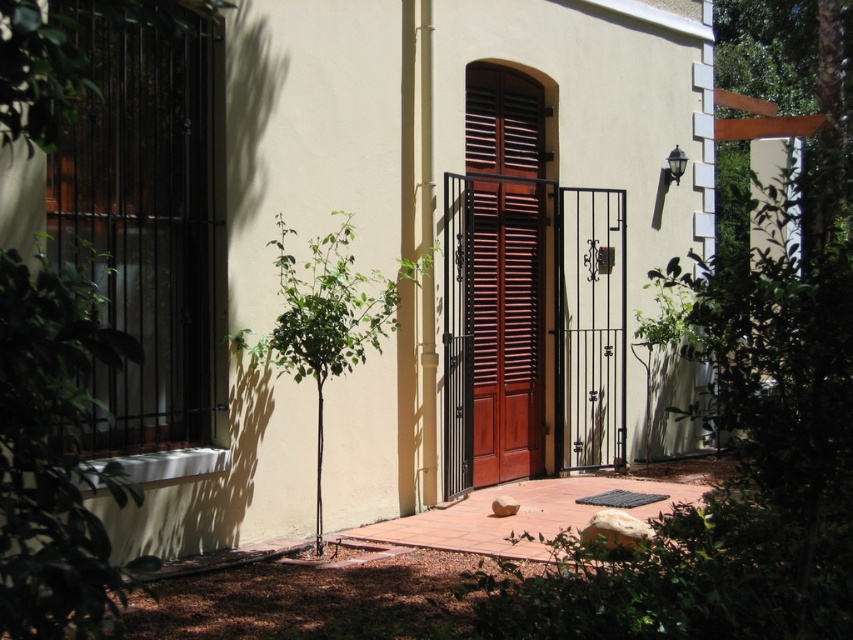
Question: Which of the following is the farthest from the observer?

Choices:
 (A) brown wooden shutters at center
 (B) black matte shutter at left

Answer: (A)

Question: Can you confirm if black matte shutter at left is positioned to the left of brown wooden shutters at center?

Choices:
 (A) no
 (B) yes

Answer: (B)

Question: Is black matte shutter at left smaller than brown wooden shutters at center?

Choices:
 (A) yes
 (B) no

Answer: (A)

Question: Does black matte shutter at left have a greater width compared to brown wooden shutters at center?

Choices:
 (A) no
 (B) yes

Answer: (A)

Question: Among these points, which one is nearest to the camera?

Choices:
 (A) (473, 481)
 (B) (107, 320)

Answer: (B)